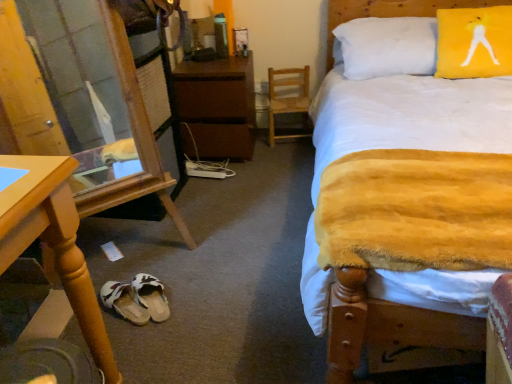
Locate an element on the screen. vacant space underneath wooden swivel chair at center (from a real-world perspective) is located at coordinates pos(290,137).